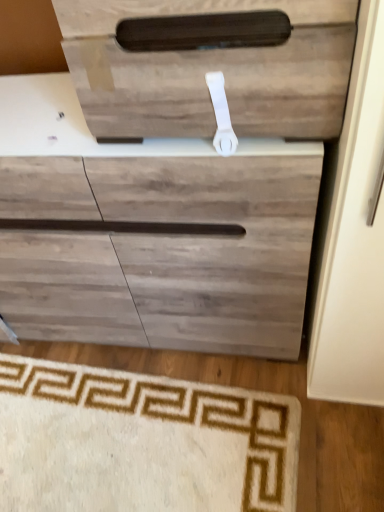
What do you see at coordinates (209, 65) in the screenshot? The width and height of the screenshot is (384, 512). I see `wooden drawer at upper center` at bounding box center [209, 65].

At what (x,y) coordinates should I click in order to perform the action: click on wooden drawer at upper center. Please return your answer as a coordinate pair (x, y). Image resolution: width=384 pixels, height=512 pixels. Looking at the image, I should click on (209, 65).

From the image's perspective, between white plastic door handle at upper center and beige carpet at lower left, which one is located above?

white plastic door handle at upper center.

From the picture: Considering the sizes of objects white plastic door handle at upper center and beige carpet at lower left in the image provided, who is shorter, white plastic door handle at upper center or beige carpet at lower left?

beige carpet at lower left is shorter.

Is white plastic door handle at upper center facing towards beige carpet at lower left?

No, white plastic door handle at upper center is not aimed at beige carpet at lower left.

From their relative heights in the image, would you say wooden drawer at upper center is taller or shorter than white plastic door handle at upper center?

Considering their sizes, wooden drawer at upper center has more height than white plastic door handle at upper center.

Which is in front, wooden drawer at upper center or white plastic door handle at upper center?

wooden drawer at upper center is more forward.

Does wooden drawer at upper center have a lesser width compared to white plastic door handle at upper center?

No, wooden drawer at upper center is not thinner than white plastic door handle at upper center.

The image size is (384, 512). Identify the location of door handle below the wooden drawer at upper center (from a real-world perspective). (221, 115).

Is beige carpet at lower left positioned beyond the bounds of wooden drawer at upper center?

That's correct, beige carpet at lower left is outside of wooden drawer at upper center.

Is point (117, 475) farther from camera compared to point (268, 18)?

Yes, it is behind point (268, 18).

Between beige carpet at lower left and wooden drawer at upper center, which one is positioned in front?

Positioned in front is wooden drawer at upper center.

Are beige carpet at lower left and wooden drawer at upper center located far from each other?

No, there isn't a large distance between beige carpet at lower left and wooden drawer at upper center.

Is white plastic door handle at upper center further to the viewer compared to wooden drawer at upper center?

Yes.

In terms of height, does white plastic door handle at upper center look taller or shorter compared to wooden drawer at upper center?

Clearly, white plastic door handle at upper center is shorter compared to wooden drawer at upper center.

Does white plastic door handle at upper center turn towards wooden drawer at upper center?

Yes.

Is white plastic door handle at upper center at the back of beige carpet at lower left?

No, beige carpet at lower left is not facing away from white plastic door handle at upper center.

From a real-world perspective, which is physically above, beige carpet at lower left or white plastic door handle at upper center?

From a 3D spatial view, white plastic door handle at upper center is above.

Are beige carpet at lower left and white plastic door handle at upper center making contact?

There is a gap between beige carpet at lower left and white plastic door handle at upper center.

Based on the photo, is beige carpet at lower left positioned beyond the bounds of white plastic door handle at upper center?

Absolutely, beige carpet at lower left is external to white plastic door handle at upper center.

Considering the positions of points (73, 19) and (16, 375), is point (73, 19) farther from camera compared to point (16, 375)?

No, it is in front of (16, 375).

From a real-world perspective, which object stands above the other?

wooden drawer at upper center, from a real-world perspective.

From their relative heights in the image, would you say wooden drawer at upper center is taller or shorter than beige carpet at lower left?

Considering their sizes, wooden drawer at upper center has more height than beige carpet at lower left.

Image resolution: width=384 pixels, height=512 pixels. I want to click on door handle above the beige carpet at lower left (from a real-world perspective), so click(221, 115).

You are a GUI agent. You are given a task and a screenshot of the screen. Output one action in this format:
    pyautogui.click(x=<x>, y=<y>)
    Task: Click on the door handle below the wooden drawer at upper center (from a real-world perspective)
    
    Given the screenshot: What is the action you would take?
    pyautogui.click(x=221, y=115)

Based on their spatial positions, is white plastic door handle at upper center or wooden drawer at upper center further from beige carpet at lower left?

wooden drawer at upper center lies further to beige carpet at lower left than the other object.

From the image, which object appears to be nearer to white plastic door handle at upper center, wooden drawer at upper center or beige carpet at lower left?

Among the two, wooden drawer at upper center is located nearer to white plastic door handle at upper center.

Looking at the image, which one is located closer to beige carpet at lower left, wooden drawer at upper center or white plastic door handle at upper center?

Among the two, white plastic door handle at upper center is located nearer to beige carpet at lower left.

Considering their positions, is beige carpet at lower left positioned further to wooden drawer at upper center than white plastic door handle at upper center?

Among the two, beige carpet at lower left is located further to wooden drawer at upper center.

Looking at the image, which one is located further to wooden drawer at upper center, white plastic door handle at upper center or beige carpet at lower left?

beige carpet at lower left.

From the image, which object appears to be farther from white plastic door handle at upper center, beige carpet at lower left or wooden drawer at upper center?

beige carpet at lower left.

The width and height of the screenshot is (384, 512). Find the location of `door handle between wooden drawer at upper center and beige carpet at lower left from top to bottom`. door handle between wooden drawer at upper center and beige carpet at lower left from top to bottom is located at coordinates (221, 115).